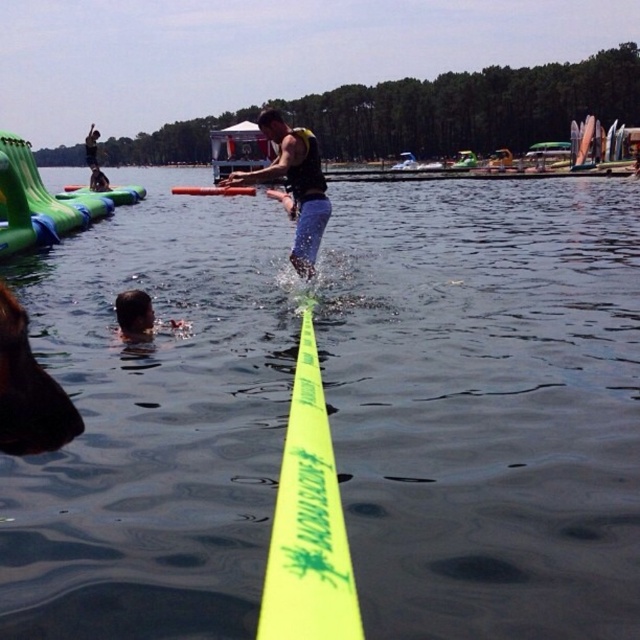
You are a lifeguard assessing the safety equipment in the water park scene. The lifeguard needs to choose between the matte black life vest at center and the dark blue wetsuit at upper left for a swimmer who needs a flotation device. Which item is wider and thus more suitable for providing buoyancy?

The matte black life vest at center is wider than the dark blue wetsuit at upper left, making it more suitable for providing buoyancy as a flotation device.

You are a lifeguard standing at the edge of the water park. You notice a person in distress at the point labeled as point [292,186]. What object is located at that point?

The object located at point [292,186] is a matte black life vest at center.

You are a lifeguard on duty at the water park. You notice the yellow neon tape at center and the dark blue wetsuit at upper left in your line of sight. Which object is positioned lower in the scene?

The yellow neon tape at center is located below dark blue wetsuit at upper left, so the yellow neon tape at center is positioned lower in the scene.